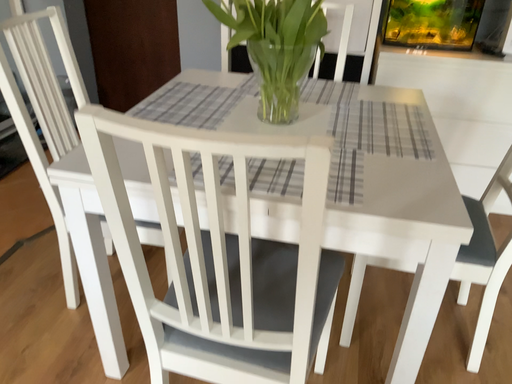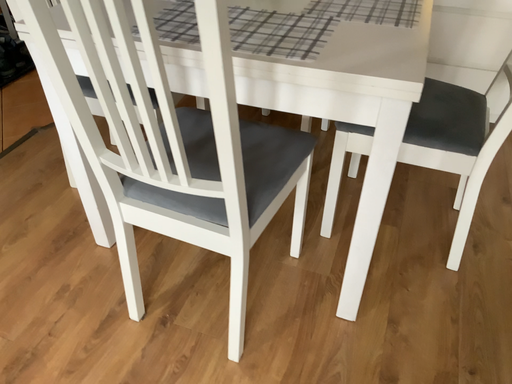
Question: Which way did the camera rotate in the video?

Choices:
 (A) rotated upward
 (B) rotated downward

Answer: (B)